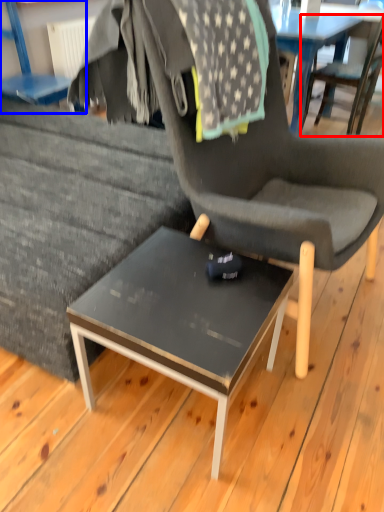
Question: Which point is further to the camera, chair (highlighted by a red box) or chair (highlighted by a blue box)?

Choices:
 (A) chair
 (B) chair

Answer: (A)